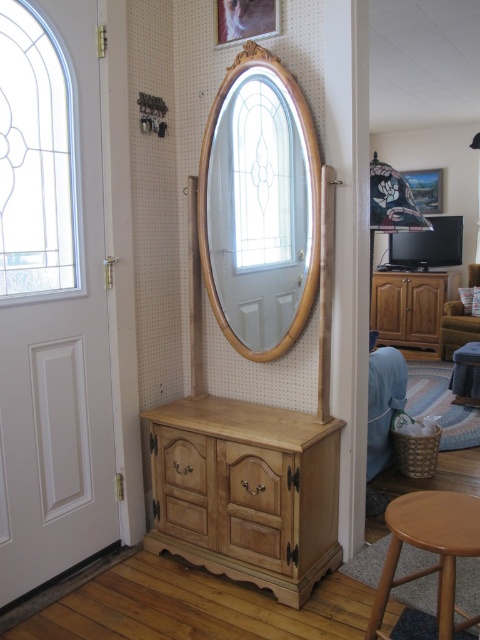
You are moving a small potted plant that is 1.2 meters tall. You want to place it on the surface between the light wood dresser at center and the wooden mirror at center. Is there enough vertical space for the plant to fit without touching either the dresser or the mirror?

The light wood dresser at center is below the wooden mirror at center, so the vertical space between them is the distance from the top of the dresser to the bottom of the mirror. Since the plant is 1.2 meters tall, we need to know if this vertical space is at least 1.2 meters. However, the exact height isn not provided in the description. Therefore, it is uncertain if there is enough space without additional information.

You are standing in the hallway and want to place a new decorative item on the light wood dresser at center. Based on the coordinates provided, where exactly should you place it?

The light wood dresser at center is located at coordinates point [245,492], so place the decorative item there.